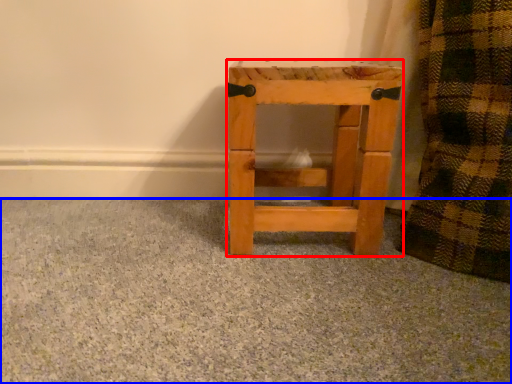
Question: Which point is further to the camera, furniture (highlighted by a red box) or concrete (highlighted by a blue box)?

Choices:
 (A) furniture
 (B) concrete

Answer: (A)